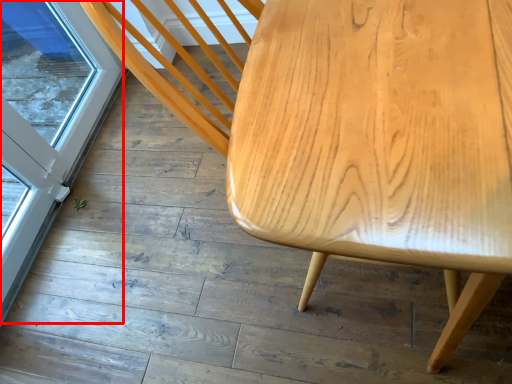
Question: From the image's perspective, where is screen door (annotated by the red box) located relative to table?

Choices:
 (A) above
 (B) below

Answer: (A)